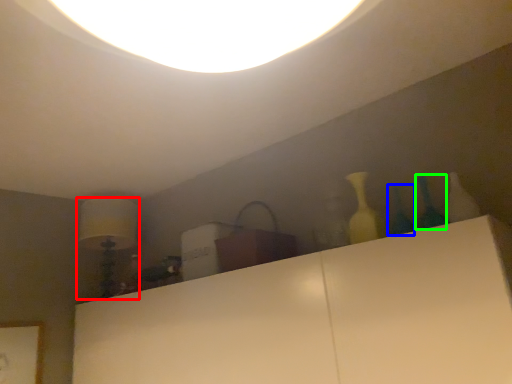
Question: Estimate the real-world distances between objects in this image. Which object is closer to lamp (highlighted by a red box), glass vase (highlighted by a blue box) or glass vase (highlighted by a green box)?

Choices:
 (A) glass vase
 (B) glass vase

Answer: (A)